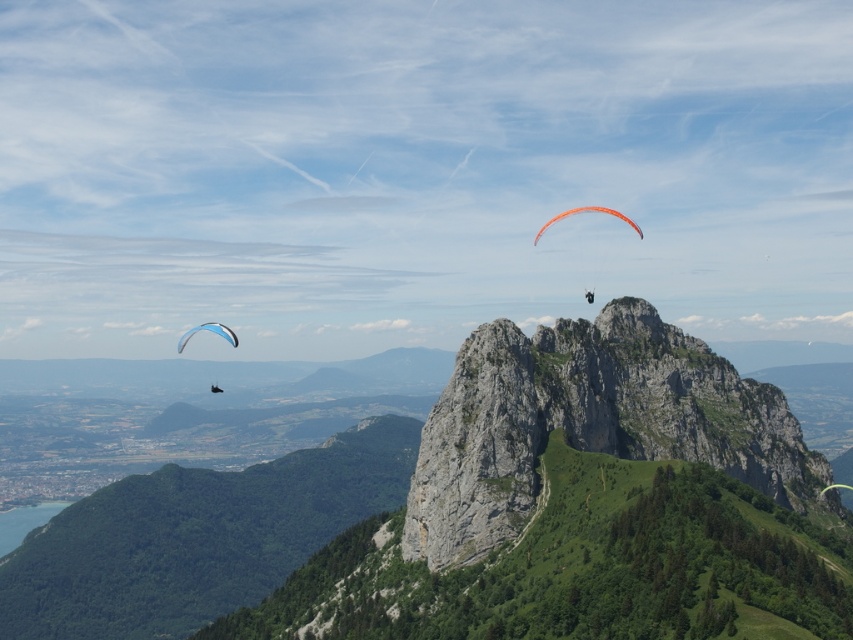
Is point (180, 346) positioned before point (637, 228)?

That is True.

Is point (228, 330) closer to camera compared to point (543, 230)?

Yes.

Locate an element on the screen. blue fabric parachute at lower left is located at coordinates (207, 330).

Who is more distant from viewer, (474, 500) or (611, 209)?

Point (611, 209)

Is rugged stone mountain at center further to camera compared to orange fabric parachute at center?

No, it is not.

Where is `rugged stone mountain at center`? Image resolution: width=853 pixels, height=640 pixels. rugged stone mountain at center is located at coordinates (426, 509).

Is rugged stone mountain at center below blue fabric parachute at lower left?

Yes.

Who is taller, rugged stone mountain at center or blue fabric parachute at lower left?

With more height is rugged stone mountain at center.

What are the coordinates of `rugged stone mountain at center` in the screenshot? It's located at (426, 509).

At what (x,y) coordinates should I click in order to perform the action: click on rugged stone mountain at center. Please return your answer as a coordinate pair (x, y). Looking at the image, I should click on point(426,509).